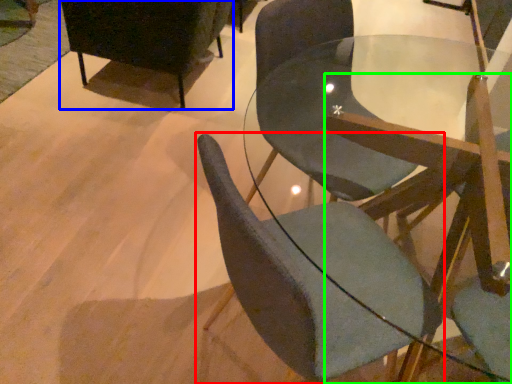
Question: Which object is the farthest from chair (highlighted by a red box)? Choose among these: chair (highlighted by a blue box) or chair (highlighted by a green box).

Choices:
 (A) chair
 (B) chair

Answer: (A)